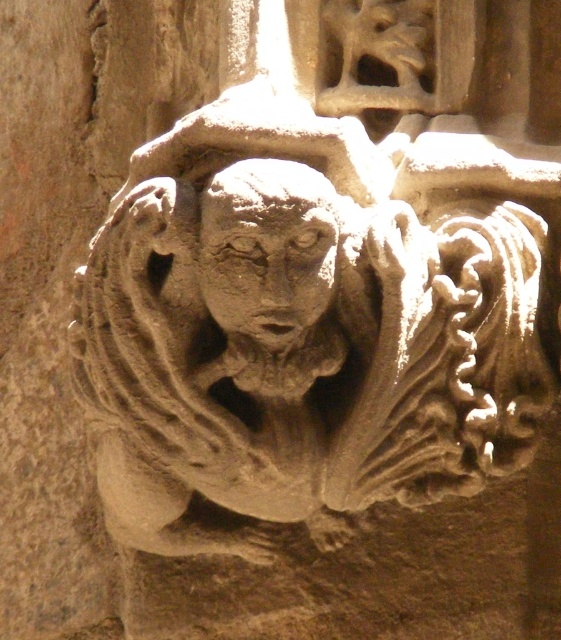
Question: Is gray stone lion at center smaller than gray stone face at center?

Choices:
 (A) no
 (B) yes

Answer: (A)

Question: Which of the following is the closest to the observer?

Choices:
 (A) (398, 236)
 (B) (256, 273)

Answer: (B)

Question: Among these points, which one is farthest from the camera?

Choices:
 (A) (439, 227)
 (B) (272, 273)

Answer: (A)

Question: Is gray stone lion at center positioned before gray stone face at center?

Choices:
 (A) yes
 (B) no

Answer: (A)

Question: Does gray stone lion at center have a greater width compared to gray stone face at center?

Choices:
 (A) yes
 (B) no

Answer: (A)